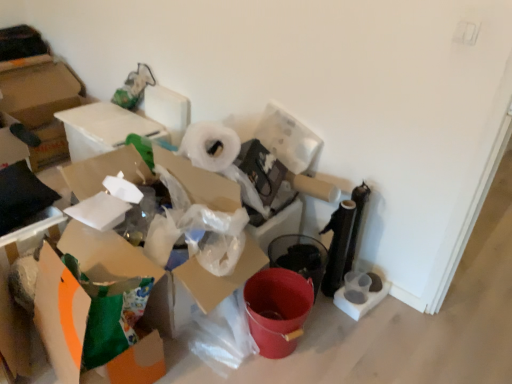
Question: Considering their positions, is orange matte cardboard box at lower left, placed as the first cardboard box when sorted from front to back, located in front of or behind transparent plastic toilet paper at lower right?

Choices:
 (A) behind
 (B) front

Answer: (B)

Question: Considering the relative positions of orange matte cardboard box at lower left, placed as the first cardboard box when sorted from front to back, and transparent plastic toilet paper at lower right in the image provided, is orange matte cardboard box at lower left, placed as the first cardboard box when sorted from front to back, to the left or to the right of transparent plastic toilet paper at lower right?

Choices:
 (A) right
 (B) left

Answer: (B)

Question: Which is nearer to the transparent plastic toilet paper at lower right?

Choices:
 (A) orange matte cardboard box at lower left, placed as the first cardboard box when sorted from front to back
 (B) white cardboard box at upper left, marked as the 1th cardboard box in a back-to-front arrangement
 (C) orange matte cardboard box at lower left, which is the 2th cardboard box in back-to-front order

Answer: (A)

Question: Estimate the real-world distances between objects in this image. Which object is closer to the transparent plastic toilet paper at lower right?

Choices:
 (A) orange matte cardboard box at lower left, arranged as the 3th cardboard box when viewed from the back
 (B) white cardboard box at upper left, marked as the 3th cardboard box in a front-to-back arrangement
 (C) orange matte cardboard box at lower left, which is the 2th cardboard box in back-to-front order

Answer: (A)